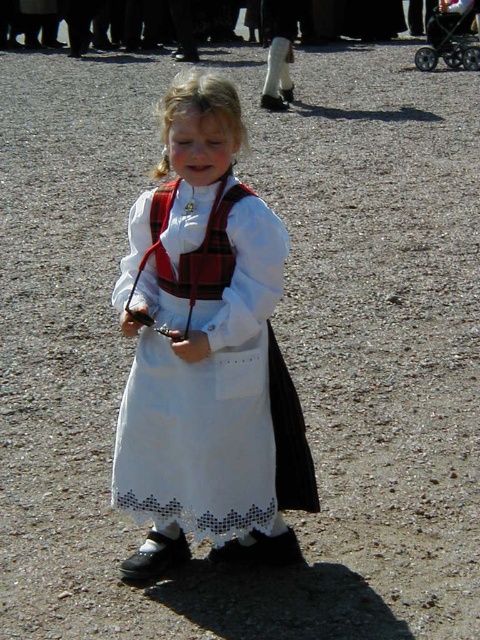
Based on the photo, who is more distant from viewer, (210, 321) or (436, 61)?

The point (436, 61) is behind.

Who is higher up, white cotton dress at center or black plastic baby carriage at upper right?

black plastic baby carriage at upper right is above.

What do you see at coordinates (208, 369) in the screenshot?
I see `white cotton dress at center` at bounding box center [208, 369].

This screenshot has width=480, height=640. I want to click on white cotton dress at center, so click(x=208, y=369).